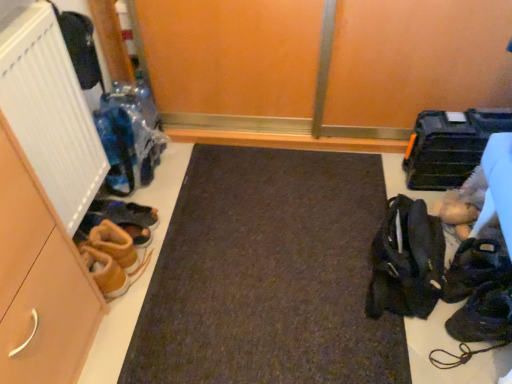
Locate an element on the screen. brown suede shoes at left, the third footwear viewed from the right is located at coordinates (121, 213).

Find the location of a particular element. The width and height of the screenshot is (512, 384). black fabric bag at right is located at coordinates (406, 261).

Where is `white ribbed radiator at left`? The width and height of the screenshot is (512, 384). white ribbed radiator at left is located at coordinates (50, 113).

Identify the location of dark brown leather shoes at lower right, which appears as the 3th footwear when viewed from the left. (480, 323).

How much space does dark brown leather shoes at lower right, which appears as the 3th footwear when viewed from the left, occupy horizontally?

dark brown leather shoes at lower right, which appears as the 3th footwear when viewed from the left, is 9.60 inches wide.

Find the location of a particular element. The image size is (512, 384). brown suede shoes at left, arranged as the 2th footwear when viewed from the left is located at coordinates (121, 213).

Is matte brown cabinet at left next to black leather shoes at lower right, the 4th footwear viewed from the left?

No, matte brown cabinet at left is not with black leather shoes at lower right, the 4th footwear viewed from the left.

From the image's perspective, which object appears higher, matte brown cabinet at left or black leather shoes at lower right, the first footwear viewed from the right?

black leather shoes at lower right, the first footwear viewed from the right, from the image's perspective.

Does matte brown cabinet at left have a lesser height compared to black leather shoes at lower right, the 4th footwear viewed from the left?

No, matte brown cabinet at left is not shorter than black leather shoes at lower right, the 4th footwear viewed from the left.

In the image, is black leather shoes at lower right, the first footwear viewed from the right, positioned in front of or behind black fabric bag at right?

Clearly, black leather shoes at lower right, the first footwear viewed from the right, is behind black fabric bag at right.

Which is behind, point (475, 282) or point (419, 301)?

The point (475, 282) is farther.

Which object is positioned more to the right, black leather shoes at lower right, the 4th footwear viewed from the left, or black fabric bag at right?

black leather shoes at lower right, the 4th footwear viewed from the left, is more to the right.

Does matte brown cabinet at left have a greater width compared to black fabric bag at right?

Correct, the width of matte brown cabinet at left exceeds that of black fabric bag at right.

Is matte brown cabinet at left inside or outside of black fabric bag at right?

The correct answer is: outside.

In the scene shown: Is matte brown cabinet at left placed right next to black fabric bag at right?

No, matte brown cabinet at left is not in contact with black fabric bag at right.

From their relative heights in the image, would you say dark brown leather shoes at lower right, which is the second footwear from right to left, is taller or shorter than black fabric bag at right?

In the image, dark brown leather shoes at lower right, which is the second footwear from right to left, appears to be shorter than black fabric bag at right.

From the image's perspective, is dark brown leather shoes at lower right, which is the second footwear from right to left, under black fabric bag at right?

Indeed, from the image's perspective, dark brown leather shoes at lower right, which is the second footwear from right to left, is shown beneath black fabric bag at right.

Based on their sizes in the image, would you say dark brown leather shoes at lower right, which is the second footwear from right to left, is bigger or smaller than black fabric bag at right?

dark brown leather shoes at lower right, which is the second footwear from right to left, is smaller than black fabric bag at right.

Is brown suede shoes at lower left, which is counted as the 4th footwear, starting from the right, taller than brown suede shoes at left, the third footwear viewed from the right?

Correct, brown suede shoes at lower left, which is counted as the 4th footwear, starting from the right, is much taller as brown suede shoes at left, the third footwear viewed from the right.

Considering the relative sizes of brown suede shoes at lower left, which is counted as the 4th footwear, starting from the right, and brown suede shoes at left, the third footwear viewed from the right, in the image provided, is brown suede shoes at lower left, which is counted as the 4th footwear, starting from the right, wider than brown suede shoes at left, the third footwear viewed from the right,?

Indeed, brown suede shoes at lower left, which is counted as the 4th footwear, starting from the right, has a greater width compared to brown suede shoes at left, the third footwear viewed from the right.

Which of these two, brown suede shoes at lower left, which appears as the first footwear when viewed from the left, or brown suede shoes at left, the third footwear viewed from the right, is smaller?

Smaller between the two is brown suede shoes at left, the third footwear viewed from the right.

Are brown suede shoes at lower left, which is counted as the 4th footwear, starting from the right, and brown suede shoes at left, arranged as the 2th footwear when viewed from the left, far apart?

No, brown suede shoes at lower left, which is counted as the 4th footwear, starting from the right, is not far away from brown suede shoes at left, arranged as the 2th footwear when viewed from the left.

Measure the distance between dark brown leather shoes at lower right, which is the second footwear from right to left, and brown suede shoes at lower left, which is counted as the 4th footwear, starting from the right.

dark brown leather shoes at lower right, which is the second footwear from right to left, and brown suede shoes at lower left, which is counted as the 4th footwear, starting from the right, are 1.05 meters apart from each other.

Between dark brown leather shoes at lower right, which appears as the 3th footwear when viewed from the left, and brown suede shoes at lower left, which appears as the first footwear when viewed from the left, which one is positioned in front?

dark brown leather shoes at lower right, which appears as the 3th footwear when viewed from the left, is closer to the camera.

From a real-world perspective, between dark brown leather shoes at lower right, which appears as the 3th footwear when viewed from the left, and brown suede shoes at lower left, which is counted as the 4th footwear, starting from the right, who is vertically higher?

In real-world perspective, dark brown leather shoes at lower right, which appears as the 3th footwear when viewed from the left, is above.

Is dark brown leather shoes at lower right, which is the second footwear from right to left, oriented towards brown suede shoes at lower left, which is counted as the 4th footwear, starting from the right?

No, dark brown leather shoes at lower right, which is the second footwear from right to left, is not facing towards brown suede shoes at lower left, which is counted as the 4th footwear, starting from the right.

From the image's perspective, is brown suede shoes at lower left, which is counted as the 4th footwear, starting from the right, located above black leather shoes at lower right, the first footwear viewed from the right?

Correct, brown suede shoes at lower left, which is counted as the 4th footwear, starting from the right, appears higher than black leather shoes at lower right, the first footwear viewed from the right, in the image.

Which object is closer to the camera, brown suede shoes at lower left, which is counted as the 4th footwear, starting from the right, or black leather shoes at lower right, the 4th footwear viewed from the left?

Positioned in front is black leather shoes at lower right, the 4th footwear viewed from the left.

You are a GUI agent. You are given a task and a screenshot of the screen. Output one action in this format:
    pyautogui.click(x=<x>, y=<y>)
    Task: Click on the footwear that is the 1st object located behind the black leather shoes at lower right, the first footwear viewed from the right
    
    Given the screenshot: What is the action you would take?
    pyautogui.click(x=114, y=242)

Does brown suede shoes at lower left, which is counted as the 4th footwear, starting from the right, appear on the left side of black leather shoes at lower right, the 4th footwear viewed from the left?

Yes, brown suede shoes at lower left, which is counted as the 4th footwear, starting from the right, is to the left of black leather shoes at lower right, the 4th footwear viewed from the left.

The width and height of the screenshot is (512, 384). I want to click on cabinetry in front of the black leather shoes at lower right, the first footwear viewed from the right, so click(x=39, y=281).

At what (x,y) coordinates should I click in order to perform the action: click on accessory on the left of black leather shoes at lower right, the 4th footwear viewed from the left. Please return your answer as a coordinate pair (x, y). Looking at the image, I should click on (406, 261).

Based on the photo, when comparing their distances from brown suede shoes at lower left, which is counted as the 4th footwear, starting from the right, does black fabric bag at right or brown suede shoes at left, arranged as the 2th footwear when viewed from the left, seem further?

black fabric bag at right is positioned further to the anchor brown suede shoes at lower left, which is counted as the 4th footwear, starting from the right.

Looking at the image, which one is located further to brown suede shoes at lower left, which appears as the first footwear when viewed from the left, white ribbed radiator at left or black leather shoes at lower right, the 4th footwear viewed from the left?

black leather shoes at lower right, the 4th footwear viewed from the left, is positioned further to the anchor brown suede shoes at lower left, which appears as the first footwear when viewed from the left.

Estimate the real-world distances between objects in this image. Which object is further from dark brown leather shoes at lower right, which is the second footwear from right to left, black leather shoes at lower right, the first footwear viewed from the right, or white ribbed radiator at left?

Among the two, white ribbed radiator at left is located further to dark brown leather shoes at lower right, which is the second footwear from right to left.

Which object lies further to the anchor point dark brown leather shoes at lower right, which is the second footwear from right to left, black fabric bag at right or white ribbed radiator at left?

Among the two, white ribbed radiator at left is located further to dark brown leather shoes at lower right, which is the second footwear from right to left.

Estimate the real-world distances between objects in this image. Which object is further from white ribbed radiator at left, black leather shoes at lower right, the 4th footwear viewed from the left, or brown suede shoes at left, arranged as the 2th footwear when viewed from the left?

Based on the image, black leather shoes at lower right, the 4th footwear viewed from the left, appears to be further to white ribbed radiator at left.

Estimate the real-world distances between objects in this image. Which object is further from dark brown leather shoes at lower right, which is the second footwear from right to left, white ribbed radiator at left or matte brown cabinet at left?

white ribbed radiator at left is positioned further to the anchor dark brown leather shoes at lower right, which is the second footwear from right to left.

Which object lies further to the anchor point black leather shoes at lower right, the first footwear viewed from the right, matte brown cabinet at left or white ribbed radiator at left?

white ribbed radiator at left is positioned further to the anchor black leather shoes at lower right, the first footwear viewed from the right.

Looking at the image, which one is located closer to brown suede shoes at lower left, which is counted as the 4th footwear, starting from the right, brown suede shoes at left, arranged as the 2th footwear when viewed from the left, or dark brown leather shoes at lower right, which appears as the 3th footwear when viewed from the left?

brown suede shoes at left, arranged as the 2th footwear when viewed from the left.

Locate an element on the screen. The width and height of the screenshot is (512, 384). footwear situated between brown suede shoes at left, arranged as the 2th footwear when viewed from the left, and black leather shoes at lower right, the first footwear viewed from the right, from left to right is located at coordinates (480, 323).

Locate an element on the screen. This screenshot has width=512, height=384. footwear between black fabric bag at right and black leather shoes at lower right, the 4th footwear viewed from the left, from left to right is located at coordinates (480, 323).

What are the coordinates of `accessory located between white ribbed radiator at left and dark brown leather shoes at lower right, which is the second footwear from right to left, in the left-right direction` in the screenshot? It's located at (406, 261).

I want to click on accessory situated between brown suede shoes at left, the third footwear viewed from the right, and black leather shoes at lower right, the 4th footwear viewed from the left, from left to right, so click(406, 261).